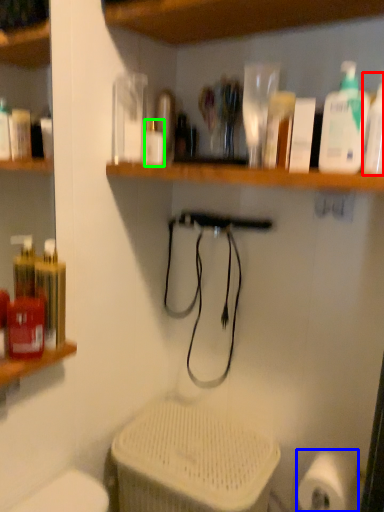
Question: Which object is positioned farthest from cleaning product (highlighted by a red box)? Select from toilet paper (highlighted by a blue box) and bottle (highlighted by a green box).

Choices:
 (A) toilet paper
 (B) bottle

Answer: (A)